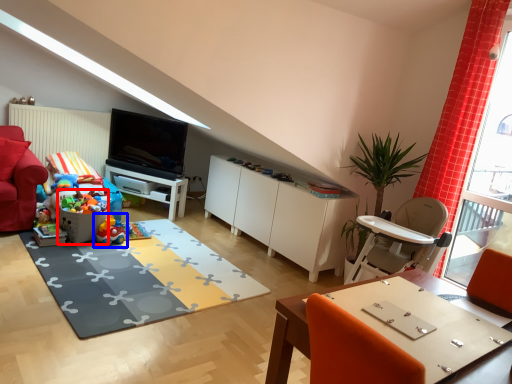
Question: Which object appears closest to the camera in this image, toy (highlighted by a red box) or toy (highlighted by a blue box)?

Choices:
 (A) toy
 (B) toy

Answer: (A)